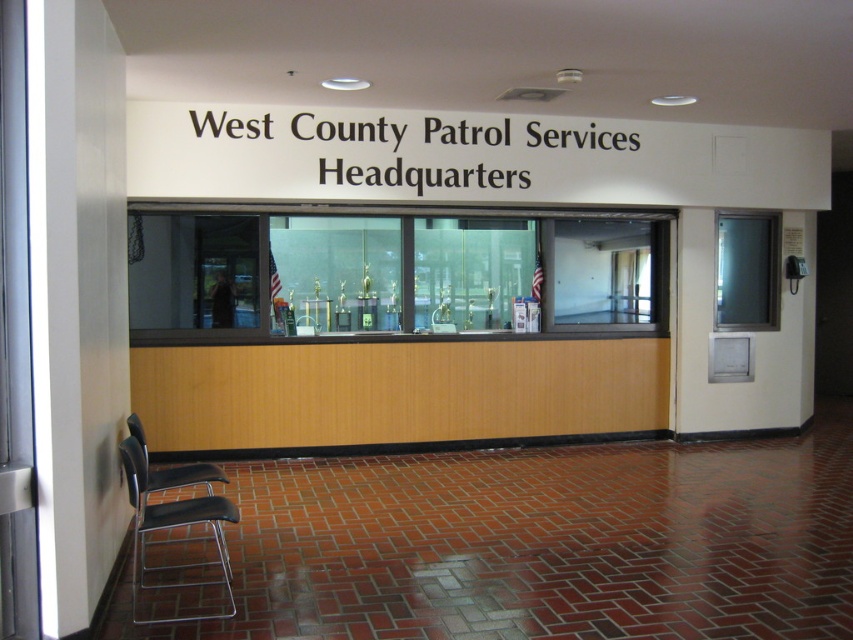
Question: Considering the relative positions of black metal chair at lower left and metallic gray chair at lower left in the image provided, where is black metal chair at lower left located with respect to metallic gray chair at lower left?

Choices:
 (A) right
 (B) left

Answer: (A)

Question: Does black metal chair at lower left have a lesser width compared to metallic gray chair at lower left?

Choices:
 (A) yes
 (B) no

Answer: (B)

Question: From the image, what is the correct spatial relationship of black metal chair at lower left in relation to metallic gray chair at lower left?

Choices:
 (A) right
 (B) left

Answer: (A)

Question: Which object appears farthest from the camera in this image?

Choices:
 (A) metallic gray chair at lower left
 (B) black metal chair at lower left

Answer: (A)